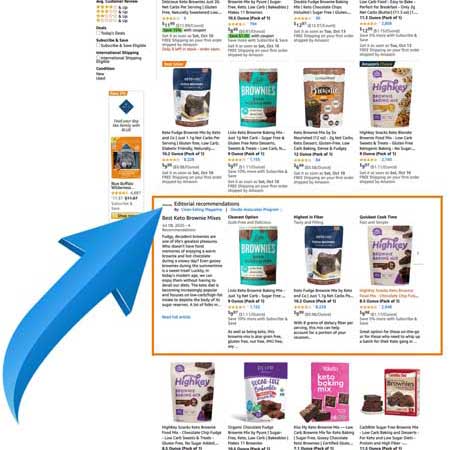
What are the coordinates of `box` in the screenshot? It's located at (145, 348).